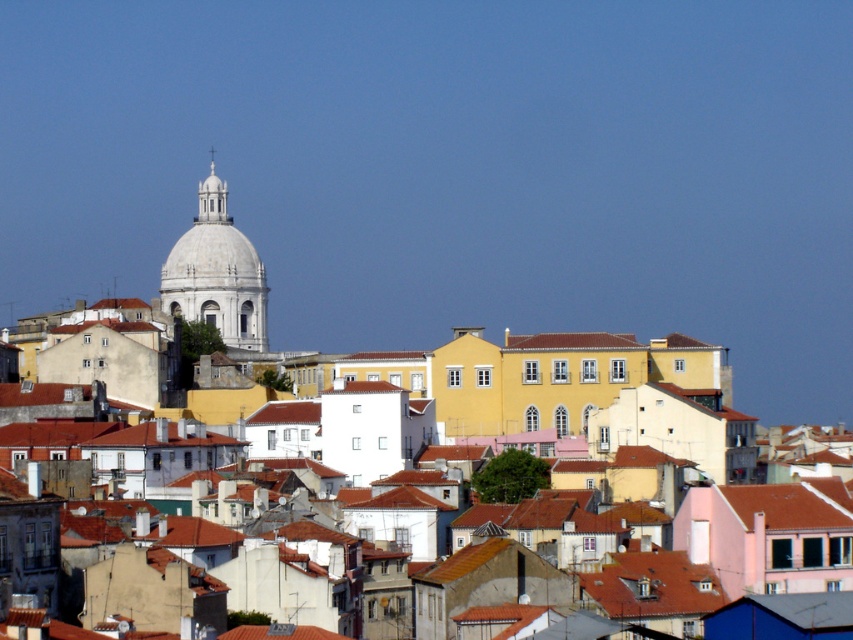
Question: Does yellow matte building at center have a smaller size compared to white marble dome at upper center?

Choices:
 (A) yes
 (B) no

Answer: (A)

Question: Which of the following is the farthest from the observer?

Choices:
 (A) white marble dome at upper center
 (B) yellow matte building at center

Answer: (A)

Question: Is yellow matte building at center to the right of white marble dome at upper center from the viewer's perspective?

Choices:
 (A) no
 (B) yes

Answer: (B)

Question: Which of the following is the farthest from the observer?

Choices:
 (A) yellow matte building at center
 (B) white marble dome at upper center

Answer: (B)

Question: Can you confirm if yellow matte building at center is bigger than white marble dome at upper center?

Choices:
 (A) yes
 (B) no

Answer: (B)